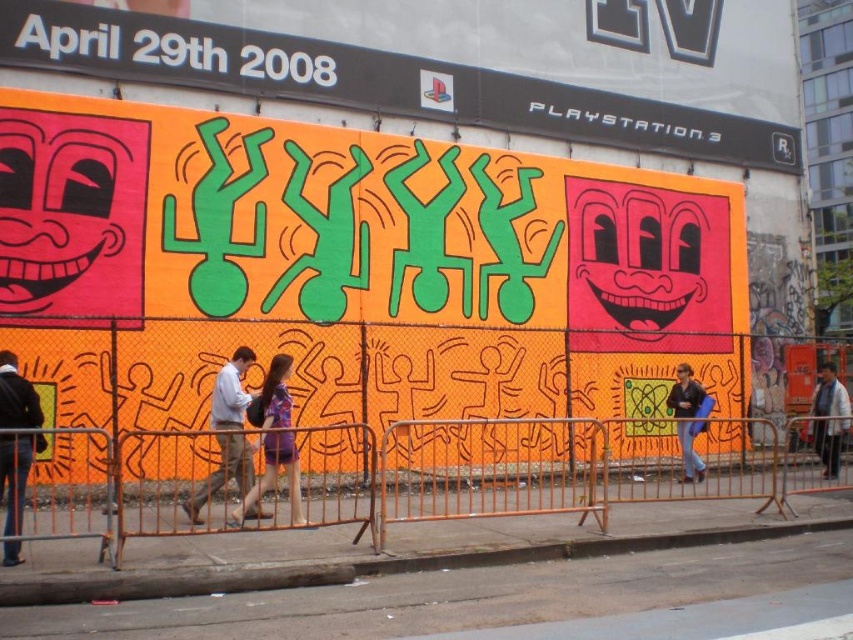
Question: Can you confirm if dark blue jacket at left is smaller than matte purple dress at center?

Choices:
 (A) yes
 (B) no

Answer: (A)

Question: Does light brown leather jacket at center come in front of matte purple dress at center?

Choices:
 (A) yes
 (B) no

Answer: (B)

Question: Which point is farther to the camera?

Choices:
 (A) orange metal fence at center
 (B) blue denim jacket at lower right
 (C) dark blue jacket at left

Answer: (B)

Question: Which point is closer to the camera?

Choices:
 (A) (10, 380)
 (B) (293, 493)

Answer: (A)

Question: Is orange matte wall art at center positioned in front of orange metal fence at center?

Choices:
 (A) yes
 (B) no

Answer: (B)

Question: Which of the following is the closest to the observer?

Choices:
 (A) matte purple dress at center
 (B) orange metal fence at center

Answer: (B)